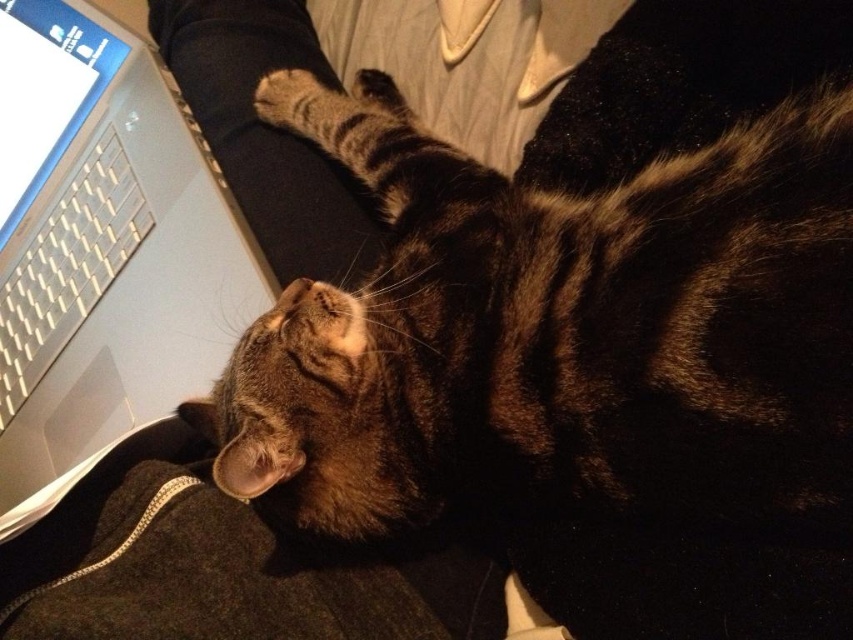
You are a photographer trying to capture a closeup shot of the brown striped fur cat at center. The camera you are using has a minimum focusing distance of 20 inches. Will you be able to move closer to the cat to get a better closeup without the image becoming blurry?

The brown striped fur cat at center is 23.28 inches away from camera. Since the minimum focusing distance is 20 inches, you can move closer up to 20 inches to get a better closeup without the image becoming blurry.

You are a person who wants to type on the white plastic keyboard at left without moving the sleek silver laptop at left. Is this possible?

The sleek silver laptop at left is in front of the white plastic keyboard at left, so you cannot type on the white plastic keyboard at left without moving the laptop first.

You are a cat owner who wants to place a new toy between the brown striped fur cat at center and the white plastic keyboard at left. The toy is 10 inches long. Will there be enough space between them to place the toy without moving either the cat or the keyboard?

The distance between the brown striped fur cat at center and the white plastic keyboard at left is 20.46 inches. Since the toy is 10 inches long, there is sufficient space to place the toy between them without moving either object.